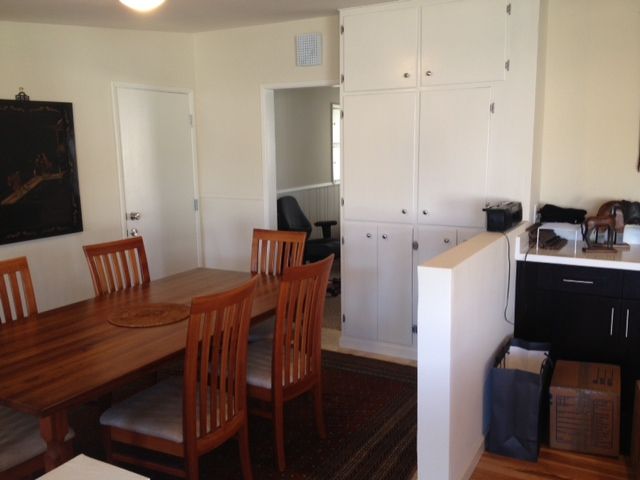
Find the location of `white chair cushion`. white chair cushion is located at coordinates (140, 414), (4, 444), (253, 356), (262, 336).